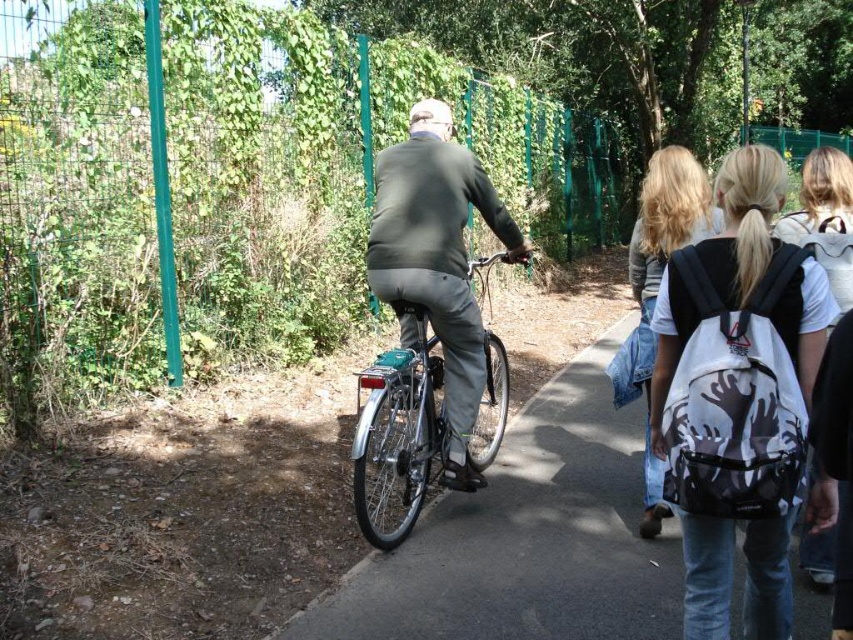
Is green wire mesh fence at upper left below dark gray sweater at center?

Actually, green wire mesh fence at upper left is above dark gray sweater at center.

Between green wire mesh fence at upper left and dark gray sweater at center, which one has less height?

Standing shorter between the two is dark gray sweater at center.

Which is behind, point (183, 340) or point (498, 208)?

The point (183, 340) is more distant.

This screenshot has height=640, width=853. I want to click on green wire mesh fence at upper left, so click(233, 184).

Is green wire mesh fence at upper left in front of white matte backpack at center right?

No, it is not.

Is green wire mesh fence at upper left shorter than white matte backpack at center right?

No.

Which is behind, point (483, 106) or point (669, 481)?

The point (483, 106) is more distant.

The image size is (853, 640). I want to click on green wire mesh fence at upper left, so click(233, 184).

Can you confirm if white matte backpack at center right is shorter than dark gray sweater at center?

Correct, white matte backpack at center right is not as tall as dark gray sweater at center.

Does white matte backpack at center right appear on the left side of dark gray sweater at center?

Incorrect, white matte backpack at center right is not on the left side of dark gray sweater at center.

Which is in front, point (752, 348) or point (381, 156)?

Point (752, 348)

Where is `white matte backpack at center right`? white matte backpack at center right is located at coordinates (738, 397).